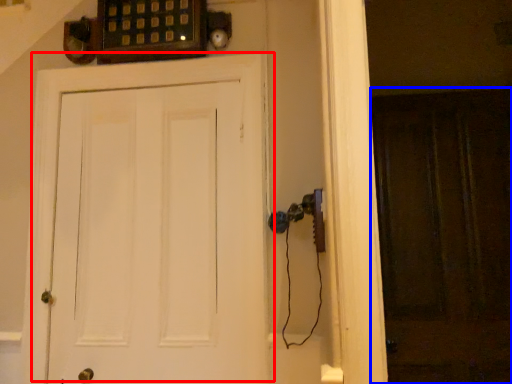
Question: Which object is further to the camera taking this photo, door (highlighted by a red box) or screen door (highlighted by a blue box)?

Choices:
 (A) door
 (B) screen door

Answer: (B)